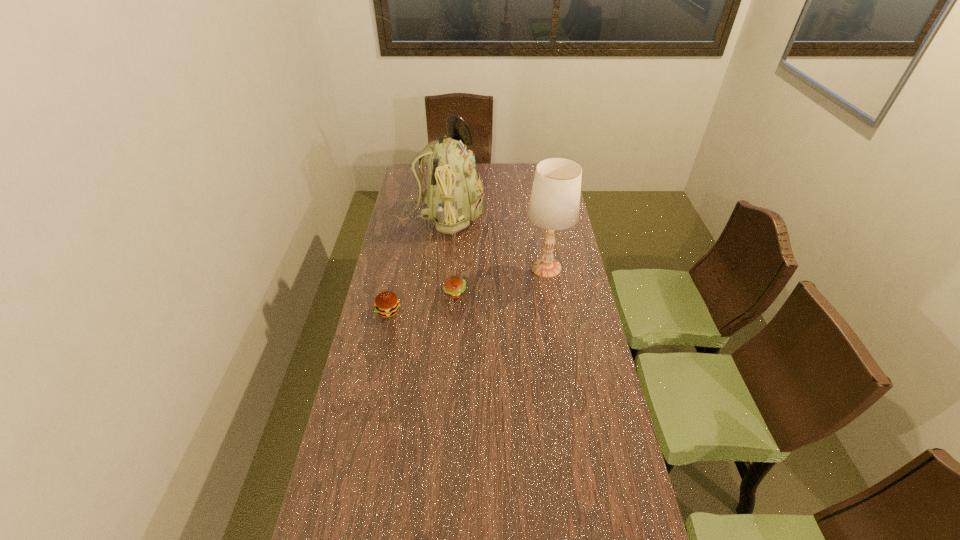
What are the coordinates of `vacant area that lies between the backpack and the shorter hamburger` in the screenshot? It's located at (448, 255).

The image size is (960, 540). I want to click on free space between the farther hamburger and the rightmost object, so click(500, 280).

Locate an element on the screen. The image size is (960, 540). free space between the lamp and the left hamburger is located at coordinates (468, 289).

Image resolution: width=960 pixels, height=540 pixels. I want to click on free area in between the third farthest object and the rightmost object, so click(x=500, y=280).

Identify the location of object identified as the closest to the backpack. (554, 204).

Select which object is the closest to the nearer hamburger. Please provide its 2D coordinates. Your answer should be formatted as a tuple, i.e. [(x, y)], where the tuple contains the x and y coordinates of a point satisfying the conditions above.

[(454, 286)]

Locate an element on the screen. The width and height of the screenshot is (960, 540). free region that satisfies the following two spatial constraints: 1. on the front-facing side of the shortest object; 2. on the left side of the backpack is located at coordinates (433, 293).

Locate an element on the screen. The width and height of the screenshot is (960, 540). vacant area in the image that satisfies the following two spatial constraints: 1. on the front-facing side of the backpack; 2. on the back side of the shorter hamburger is located at coordinates (433, 293).